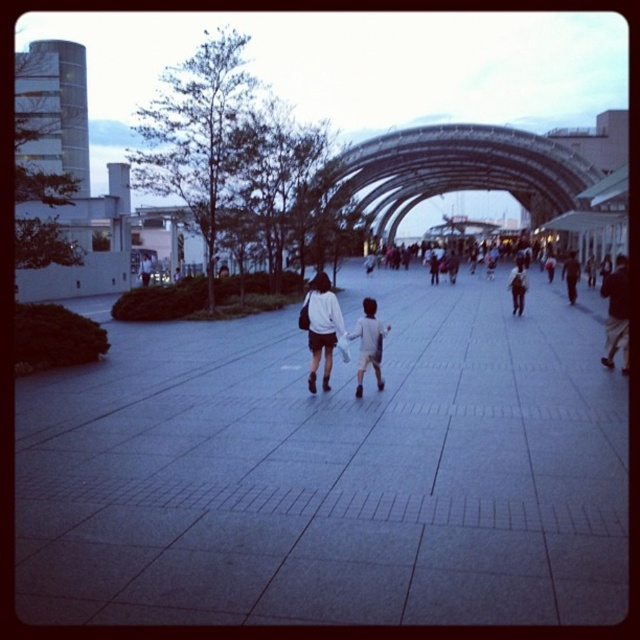
Question: Is gray concrete pavement at center smaller than white cotton shirt at center?

Choices:
 (A) yes
 (B) no

Answer: (B)

Question: Which object is positioned closest to the white cotton shirt at center?

Choices:
 (A) gray concrete pavement at center
 (B) dark blue jeans at center

Answer: (A)

Question: Is gray concrete pavement at center to the left of white matte jacket at center from the viewer's perspective?

Choices:
 (A) yes
 (B) no

Answer: (B)

Question: Which point is closer to the camera taking this photo?

Choices:
 (A) (518, 289)
 (B) (627, 349)

Answer: (B)

Question: Can you confirm if dark fabric jacket at center is wider than dark gray pants at center?

Choices:
 (A) no
 (B) yes

Answer: (B)

Question: Which of the following is the farthest from the observer?

Choices:
 (A) dark blue jeans at center
 (B) gray concrete pavement at center
 (C) white matte jacket at center

Answer: (A)